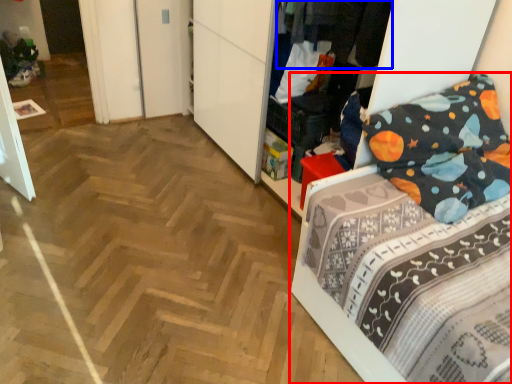
Question: Which object appears farthest to the camera in this image, bed (highlighted by a red box) or clothing (highlighted by a blue box)?

Choices:
 (A) bed
 (B) clothing

Answer: (B)